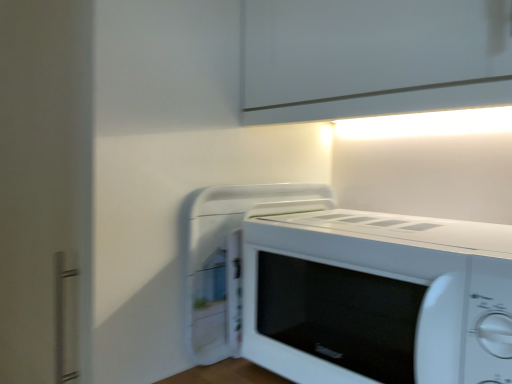
What is the approximate height of white plastic microwave at center?

It is 12.78 inches.

This screenshot has width=512, height=384. In order to click on white plastic microwave at center in this screenshot , I will do `click(227, 260)`.

What do you see at coordinates (227, 260) in the screenshot?
I see `white plastic microwave at center` at bounding box center [227, 260].

Find the location of a particular element. white matte microwave at center is located at coordinates (354, 288).

What do you see at coordinates (354, 288) in the screenshot?
I see `white matte microwave at center` at bounding box center [354, 288].

Locate an element on the screen. white plastic microwave at center is located at coordinates (227, 260).

Between white plastic microwave at center and white matte microwave at center, which one appears on the left side from the viewer's perspective?

white plastic microwave at center.

In the scene shown: Between white plastic microwave at center and white matte microwave at center, which one is positioned in front?

white matte microwave at center.

Is point (198, 193) closer or farther from the camera than point (254, 314)?

Point (198, 193) is positioned closer to the camera compared to point (254, 314).

From the image's perspective, which is above, white plastic microwave at center or white matte microwave at center?

white plastic microwave at center.

From a real-world perspective, who is located lower, white plastic microwave at center or white matte microwave at center?

In real-world perspective, white matte microwave at center is lower.

Based on the photo, between white plastic microwave at center and white matte microwave at center, which one has smaller width?

white matte microwave at center is thinner.

Considering the sizes of objects white plastic microwave at center and white matte microwave at center in the image provided, who is taller, white plastic microwave at center or white matte microwave at center?

white plastic microwave at center is taller.

Considering the sizes of white plastic microwave at center and white matte microwave at center in the image, is white plastic microwave at center bigger or smaller than white matte microwave at center?

Considering their sizes, white plastic microwave at center takes up less space than white matte microwave at center.

Is white plastic microwave at center outside of white matte microwave at center?

white plastic microwave at center lies outside white matte microwave at center's area.

Can you see white plastic microwave at center touching white matte microwave at center?

No, white plastic microwave at center is not next to white matte microwave at center.

Could you tell me if white plastic microwave at center is turned towards white matte microwave at center?

No, white plastic microwave at center is not aimed at white matte microwave at center.

How distant is white plastic microwave at center from white matte microwave at center?

The distance of white plastic microwave at center from white matte microwave at center is 4.92 inches.

Where is `appliance above the white matte microwave at center (from a real-world perspective)`? The width and height of the screenshot is (512, 384). appliance above the white matte microwave at center (from a real-world perspective) is located at coordinates (227, 260).

Considering the positions of objects white matte microwave at center and white plastic microwave at center in the image provided, who is more to the left, white matte microwave at center or white plastic microwave at center?

white plastic microwave at center is more to the left.

Considering their positions, is white matte microwave at center located in front of or behind white plastic microwave at center?

Visually, white matte microwave at center is located in front of white plastic microwave at center.

Which is in front, point (425, 371) or point (234, 328)?

Positioned in front is point (425, 371).

From the image's perspective, is white matte microwave at center above white plastic microwave at center?

No, from the image's perspective, white matte microwave at center is not over white plastic microwave at center.

Looking at this image, from a real-world perspective, is white matte microwave at center positioned above or below white plastic microwave at center?

In terms of real-world spatial position, white matte microwave at center is below white plastic microwave at center.

Which object is thinner, white matte microwave at center or white plastic microwave at center?

white matte microwave at center is thinner.

Does white matte microwave at center have a lesser height compared to white plastic microwave at center?

Yes.

Considering the relative sizes of white matte microwave at center and white plastic microwave at center in the image provided, is white matte microwave at center bigger than white plastic microwave at center?

Yes.

Consider the image. Can white plastic microwave at center be found inside white matte microwave at center?

No, white matte microwave at center does not contain white plastic microwave at center.

Is there a large distance between white matte microwave at center and white plastic microwave at center?

They are positioned close to each other.

Could you tell me if white matte microwave at center is turned towards white plastic microwave at center?

No, white matte microwave at center is not turned towards white plastic microwave at center.

Can you tell me how much white matte microwave at center and white plastic microwave at center differ in facing direction?

6.89e-05 degrees separate the facing orientations of white matte microwave at center and white plastic microwave at center.

Find the location of a particular element. appliance behind the white matte microwave at center is located at coordinates (227, 260).

Identify the location of home appliance below the white plastic microwave at center (from a real-world perspective). Image resolution: width=512 pixels, height=384 pixels. (354, 288).

Find the location of a particular element. The image size is (512, 384). appliance above the white matte microwave at center (from a real-world perspective) is located at coordinates (227, 260).